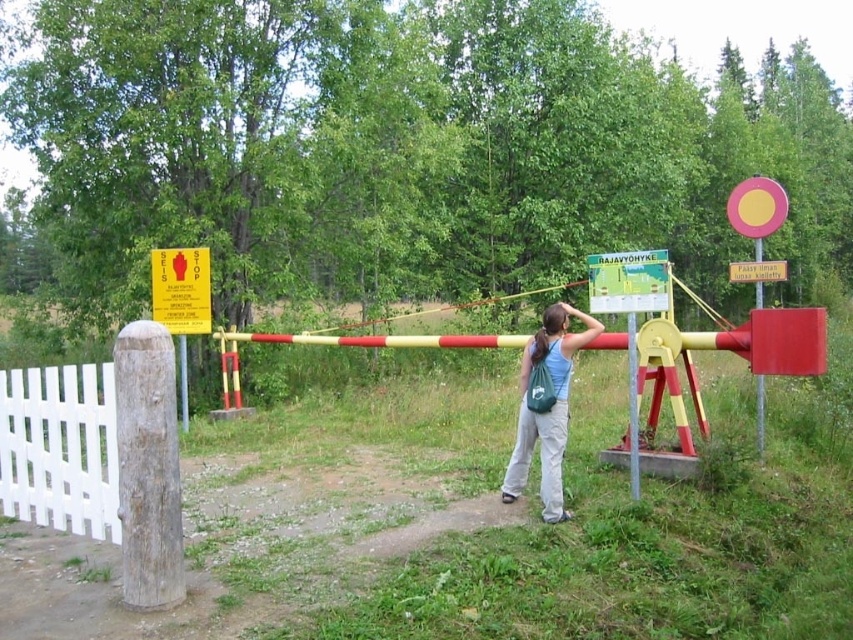
Can you confirm if brown hair at center is wider than wooden post at left?

Yes.

How far apart are brown hair at center and wooden post at left?

A distance of 6.21 meters exists between brown hair at center and wooden post at left.

Between point (556, 333) and point (184, 368), which one is positioned behind?

Positioned behind is point (184, 368).

Identify the location of brown hair at center. The height and width of the screenshot is (640, 853). (552, 321).

Which is more to the right, metallic pole at center or wooden post at left?

metallic pole at center

Is point (631, 326) more distant than point (183, 401)?

No.

This screenshot has width=853, height=640. Find the location of `metallic pole at center`. metallic pole at center is located at coordinates (631, 408).

Looking at this image, can you confirm if yellow paper sign at upper left is thinner than metallic pole at center?

In fact, yellow paper sign at upper left might be wider than metallic pole at center.

You are a GUI agent. You are given a task and a screenshot of the screen. Output one action in this format:
    pyautogui.click(x=<x>, y=<y>)
    Task: Click on the yellow paper sign at upper left
    
    Given the screenshot: What is the action you would take?
    pyautogui.click(x=181, y=289)